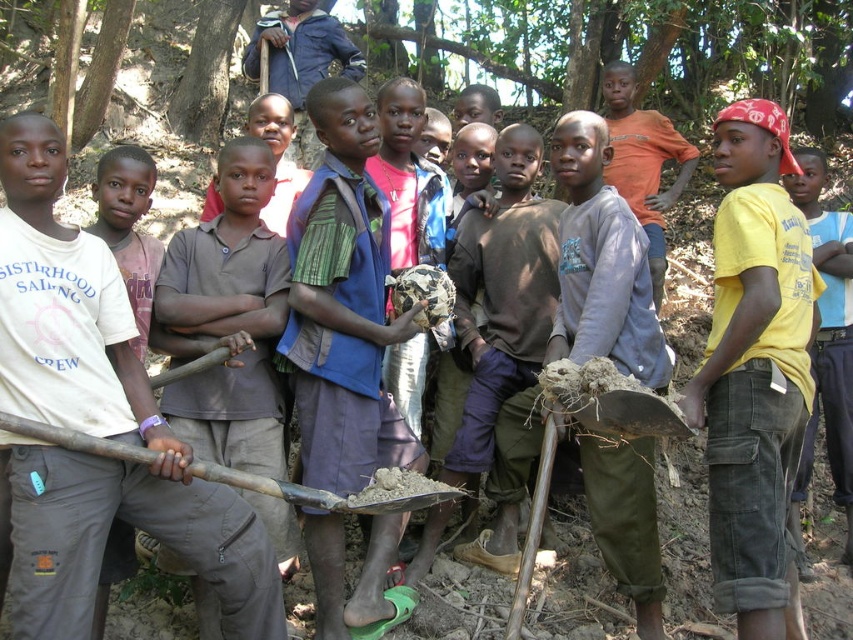
Question: Does brown cotton shirt at center come behind wooden shovel at center?

Choices:
 (A) yes
 (B) no

Answer: (A)

Question: Is yellow cotton shirt at right smaller than blue fabric shirt at center?

Choices:
 (A) no
 (B) yes

Answer: (A)

Question: Which of the following is the farthest from the observer?

Choices:
 (A) blue fabric shirt at center
 (B) wooden shovel at center

Answer: (A)

Question: Which object is farther from the camera taking this photo?

Choices:
 (A) blue fabric shirt at center
 (B) yellow cotton shirt at right
 (C) orange cotton shirt at center

Answer: (C)

Question: Considering the relative positions of brown cotton shirt at center and wooden shovel at center in the image provided, where is brown cotton shirt at center located with respect to wooden shovel at center?

Choices:
 (A) right
 (B) left

Answer: (B)

Question: Which point is closer to the camera taking this photo?

Choices:
 (A) (793, 304)
 (B) (187, 243)

Answer: (A)